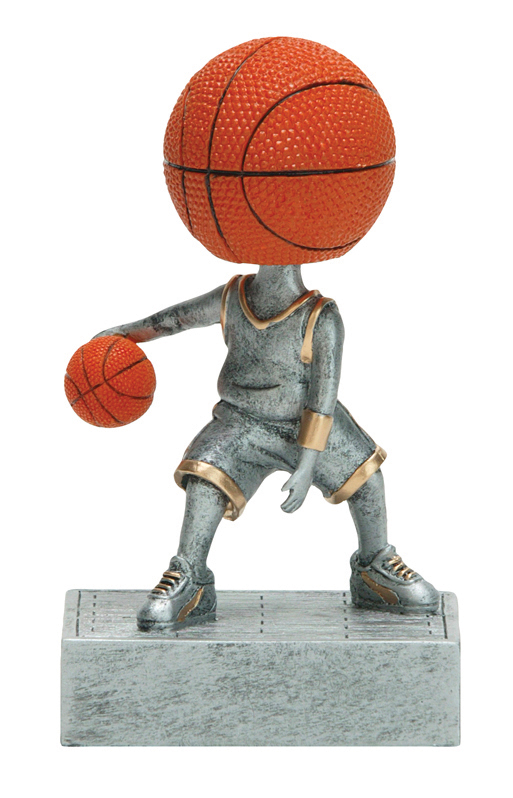
The height and width of the screenshot is (798, 513). What are the coordinates of `steel trophy` in the screenshot? It's located at (266, 392).